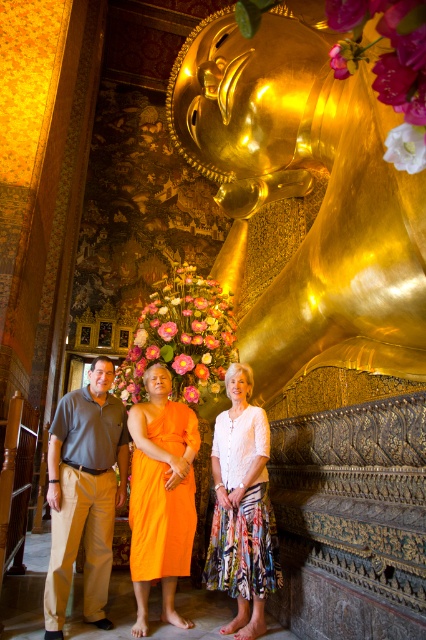
Does matte orange robe at center come in front of white floral skirt at center?

Yes, matte orange robe at center is closer to the viewer.

Looking at this image, does matte orange robe at center appear on the right side of white floral skirt at center?

In fact, matte orange robe at center is to the left of white floral skirt at center.

Image resolution: width=426 pixels, height=640 pixels. I want to click on matte orange robe at center, so click(x=161, y=496).

Is khaki cotton pants at center above orange silk robe at center?

Correct, khaki cotton pants at center is located above orange silk robe at center.

Which is behind, point (83, 500) or point (170, 593)?

Positioned behind is point (83, 500).

Where is `khaki cotton pants at center`? The height and width of the screenshot is (640, 426). khaki cotton pants at center is located at coordinates (85, 493).

Between gold polished statue at center and matte orange robe at center, which one has less height?

matte orange robe at center

Between point (276, 116) and point (138, 493), which one is positioned in front?

Point (138, 493)

Find the location of `gold polished statue at center`. gold polished statue at center is located at coordinates (304, 195).